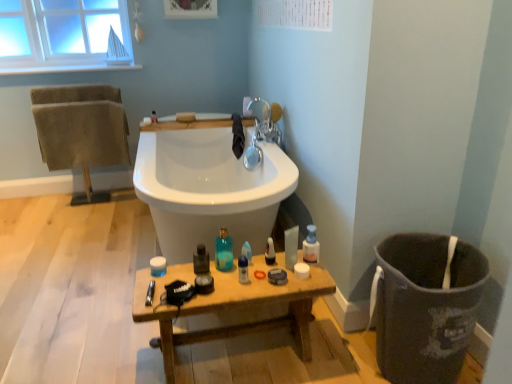
Question: Can you confirm if translucent plastic spray bottle at center, the 1th cleaning product when ordered from left to right, is taller than translucent blue glass bottle at center, which is the third toiletry in left-to-right order?

Choices:
 (A) no
 (B) yes

Answer: (A)

Question: Is translucent plastic spray bottle at center, arranged as the second cleaning product when viewed from the right, aimed at translucent blue glass bottle at center, which is the third toiletry in left-to-right order?

Choices:
 (A) yes
 (B) no

Answer: (A)

Question: Is translucent plastic spray bottle at center, arranged as the second cleaning product when viewed from the right, beside translucent blue glass bottle at center, the 2th toiletry in the bottom-to-top sequence?

Choices:
 (A) no
 (B) yes

Answer: (A)

Question: Does translucent plastic spray bottle at center, arranged as the second cleaning product when viewed from the right, lie in front of translucent blue glass bottle at center, the 2th toiletry in the bottom-to-top sequence?

Choices:
 (A) yes
 (B) no

Answer: (B)

Question: Does translucent plastic spray bottle at center, arranged as the second cleaning product when viewed from the right, have a greater width compared to translucent blue glass bottle at center, which is the third toiletry in left-to-right order?

Choices:
 (A) yes
 (B) no

Answer: (B)

Question: Does point (44, 160) appear closer or farther from the camera than point (239, 271)?

Choices:
 (A) farther
 (B) closer

Answer: (A)

Question: From a real-world perspective, relative to blue glossy bottle at center, the 2th mouthwash in the left-to-right sequence, is brown textured towels at left, the 2th bath towel from the right, vertically above or below?

Choices:
 (A) below
 (B) above

Answer: (B)

Question: Is brown textured towels at left, which is the first bath towel in left-to-right order, taller or shorter than blue glossy bottle at center, the 2th mouthwash in the left-to-right sequence?

Choices:
 (A) short
 (B) tall

Answer: (B)

Question: Is brown textured towels at left, which is the first bath towel in left-to-right order, inside the boundaries of blue glossy bottle at center, which is the 1th mouthwash in right-to-left order, or outside?

Choices:
 (A) outside
 (B) inside

Answer: (A)

Question: In terms of width, does translucent blue glass bottle at center, the 2th toiletry in the bottom-to-top sequence, look wider or thinner when compared to blue glossy bottle at center, which is the 1th mouthwash in right-to-left order?

Choices:
 (A) thin
 (B) wide

Answer: (B)

Question: Relative to blue glossy bottle at center, the 2th mouthwash in the left-to-right sequence, is translucent blue glass bottle at center, which is counted as the 3th toiletry, starting from the top, in front or behind?

Choices:
 (A) behind
 (B) front

Answer: (A)

Question: Choose the correct answer: Is translucent blue glass bottle at center, which is counted as the 3th toiletry, starting from the top, inside blue glossy bottle at center, the 2th mouthwash in the left-to-right sequence, or outside it?

Choices:
 (A) outside
 (B) inside

Answer: (A)

Question: Based on their positions, is translucent blue glass bottle at center, the 2th toiletry when ordered from right to left, located to the left or right of blue glossy bottle at center, which is the 1th mouthwash in right-to-left order?

Choices:
 (A) left
 (B) right

Answer: (A)

Question: Is translucent plastic bottle at center, which appears as the third toiletry when viewed from the front, situated inside translucent blue glass bottle at center, the 2th toiletry in the bottom-to-top sequence, or outside?

Choices:
 (A) inside
 (B) outside

Answer: (B)

Question: Considering the positions of translucent plastic bottle at center, which is the 2th toiletry in back-to-front order, and translucent blue glass bottle at center, which is counted as the 3th toiletry, starting from the top, in the image, is translucent plastic bottle at center, which is the 2th toiletry in back-to-front order, taller or shorter than translucent blue glass bottle at center, which is counted as the 3th toiletry, starting from the top,?

Choices:
 (A) short
 (B) tall

Answer: (A)